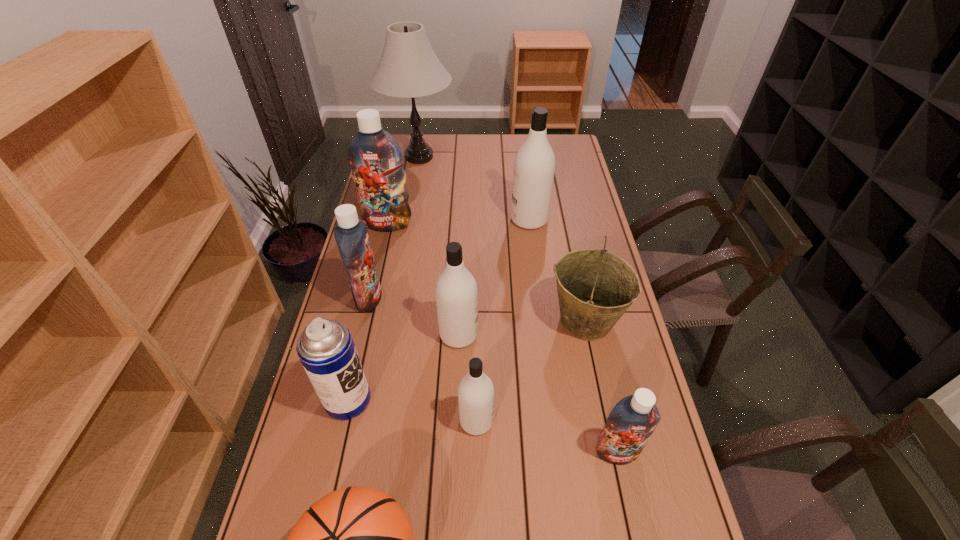
Where is `lamp`? Image resolution: width=960 pixels, height=540 pixels. lamp is located at coordinates (408, 68).

Locate an element on the screen. The width and height of the screenshot is (960, 540). black lamp is located at coordinates (408, 68).

Locate an element on the screen. The height and width of the screenshot is (540, 960). the second shampoo from right to left is located at coordinates coord(534,166).

Locate an element on the screen. The image size is (960, 540). the biggest white shampoo is located at coordinates (534, 166).

Image resolution: width=960 pixels, height=540 pixels. What are the coordinates of `the biggest blue shampoo` in the screenshot? It's located at (376, 159).

Identify the location of the fourth nearest shampoo. tap(351, 234).

Where is `the second biggest blue shampoo`? The height and width of the screenshot is (540, 960). the second biggest blue shampoo is located at coordinates (351, 234).

Locate an element on the screen. The height and width of the screenshot is (540, 960). the second smallest white shampoo is located at coordinates (456, 290).

Where is `the second farthest white shampoo`? The image size is (960, 540). the second farthest white shampoo is located at coordinates (456, 290).

Where is `wine bucket`? The height and width of the screenshot is (540, 960). wine bucket is located at coordinates (595, 287).